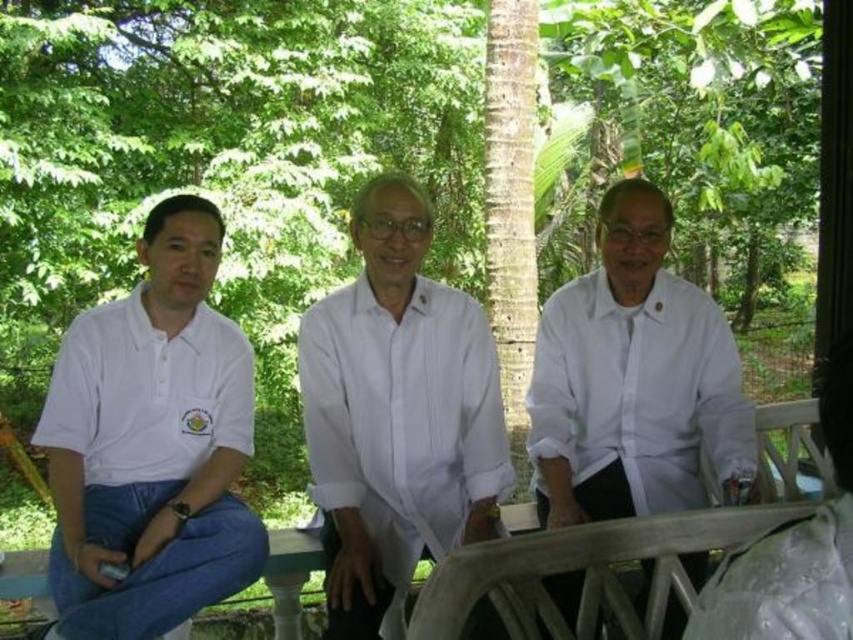
Question: Which of these objects is positioned closest to the white cotton shirt at center?

Choices:
 (A) white matte shirt at center
 (B) white matte polo shirt at left
 (C) white fabric bag at center
 (D) white cotton polo shirt at left

Answer: (A)

Question: Which object is farther from the camera taking this photo?

Choices:
 (A) white matte polo shirt at left
 (B) white cotton shirt at center

Answer: (A)

Question: In this image, where is green leafy tree at center located relative to white fabric bag at center?

Choices:
 (A) below
 (B) above

Answer: (B)

Question: Where is green leafy tree at center located in relation to white matte shirt at center in the image?

Choices:
 (A) right
 (B) left

Answer: (B)

Question: Which point appears farthest from the camera in this image?

Choices:
 (A) [119, 314]
 (B) [666, 113]
 (C) [157, 384]

Answer: (B)

Question: Can you confirm if white matte shirt at center is positioned below white matte polo shirt at left?

Choices:
 (A) yes
 (B) no

Answer: (A)